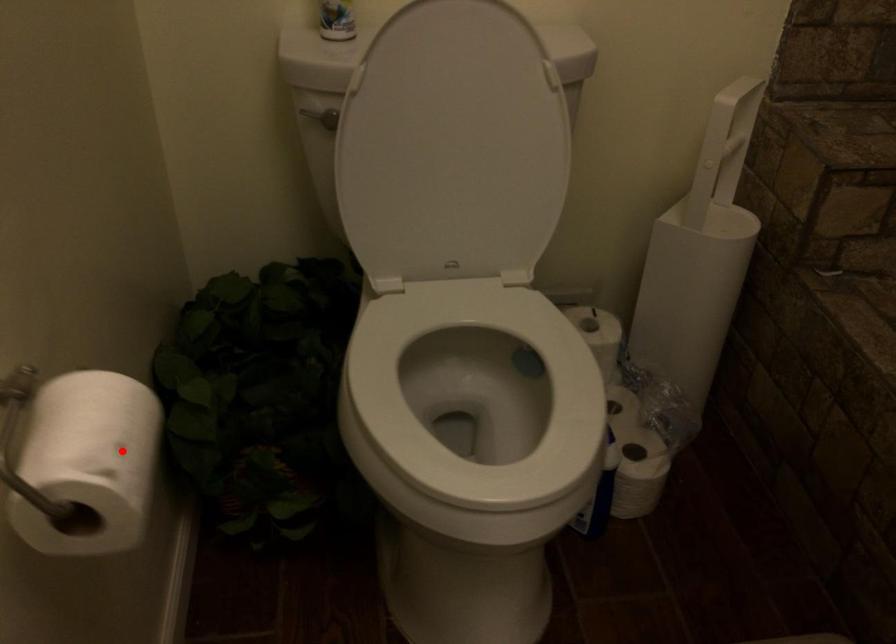
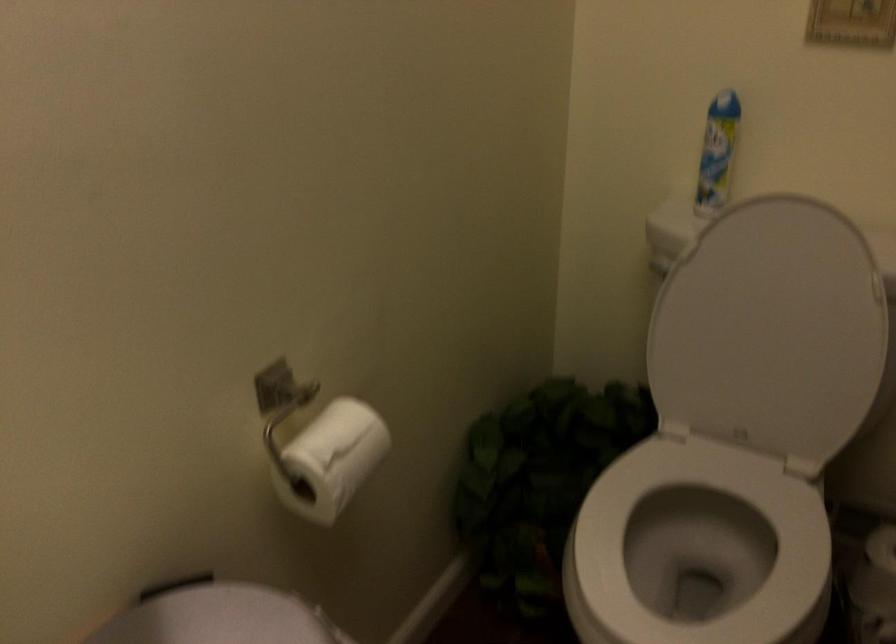
Find the pixel in the second image that matches the highlighted location in the first image.

(331, 459)